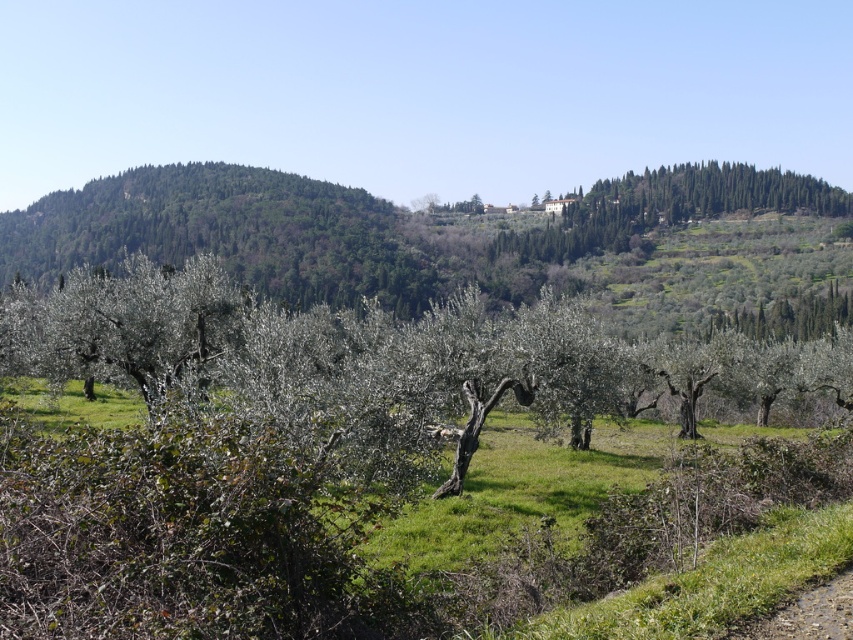
Question: Observing the image, what is the correct spatial positioning of green leafy tree at center in reference to green leafy trees at upper right?

Choices:
 (A) above
 (B) below

Answer: (B)

Question: Which of the following is the closest to the observer?

Choices:
 (A) green leafy tree at center
 (B) green leafy trees at upper right

Answer: (A)

Question: Is green leafy tree at center thinner than green leafy trees at upper right?

Choices:
 (A) no
 (B) yes

Answer: (B)

Question: Does green leafy tree at center appear on the left side of green leafy trees at upper right?

Choices:
 (A) yes
 (B) no

Answer: (A)

Question: Which point is closer to the camera taking this photo?

Choices:
 (A) click(697, 214)
 (B) click(24, 294)

Answer: (B)